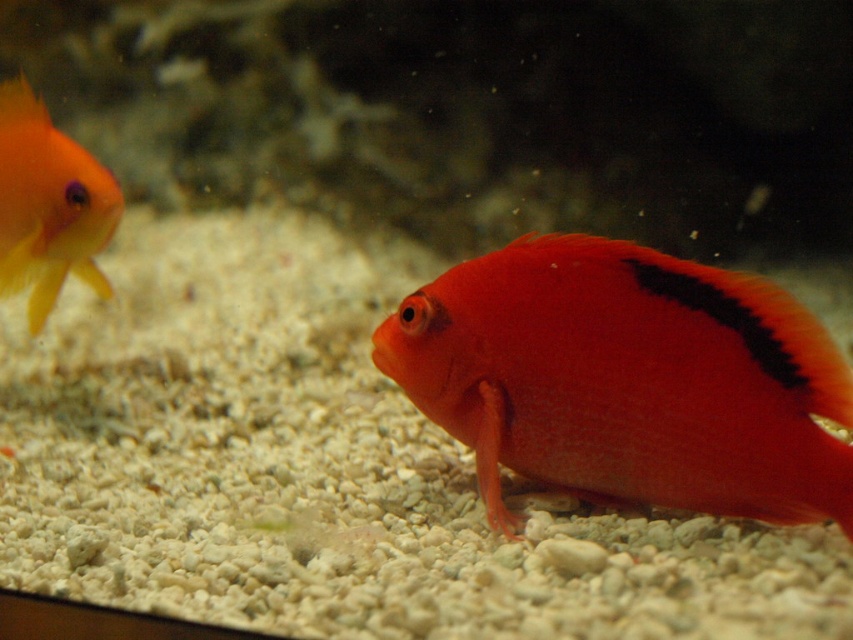
You are an aquarium maintenance worker who needs to identify the position of two fish. According to the image, where is the shiny orange fish at center relative to the matte orange goldfish at left?

The shiny orange fish at center is located below the matte orange goldfish at left.

You are a marine biologist observing an aquarium. You notice a point marked at coordinates [628,380]. Which fish is located at this point?

The point at [628,380] marks the shiny orange fish at center.

You are an underwater photographer trying to capture a shot of both the shiny orange fish at center and the matte orange goldfish at left. Based on their positions, which fish is closer to the left edge of the frame?

The matte orange goldfish at left is closer to the left edge of the frame because the shiny orange fish at center is positioned to the right of it.